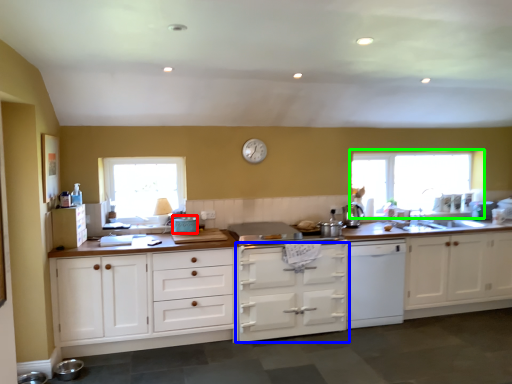
Question: Based on their relative distances, which object is nearer to appliance (highlighted by a red box)? Choose from cabinetry (highlighted by a blue box) and window (highlighted by a green box).

Choices:
 (A) cabinetry
 (B) window

Answer: (A)